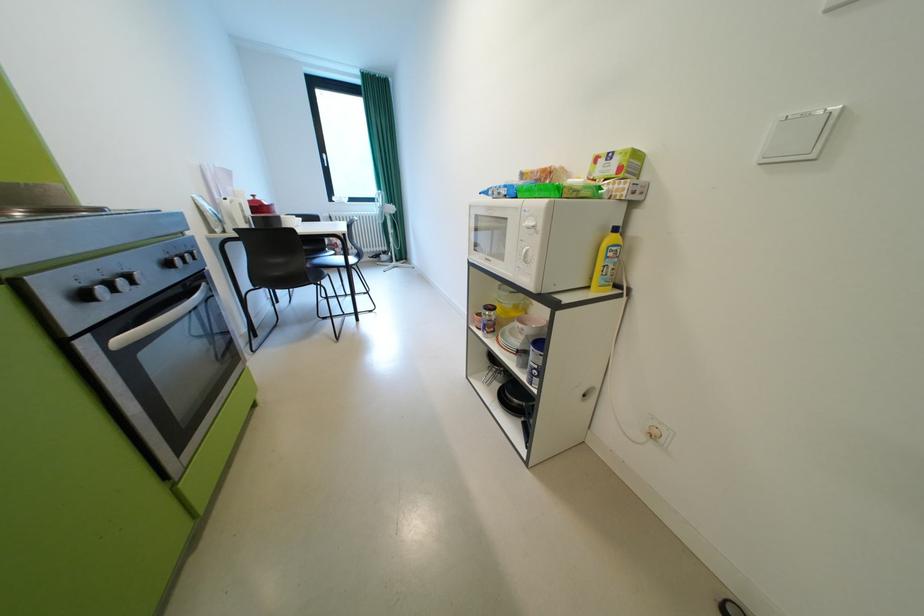
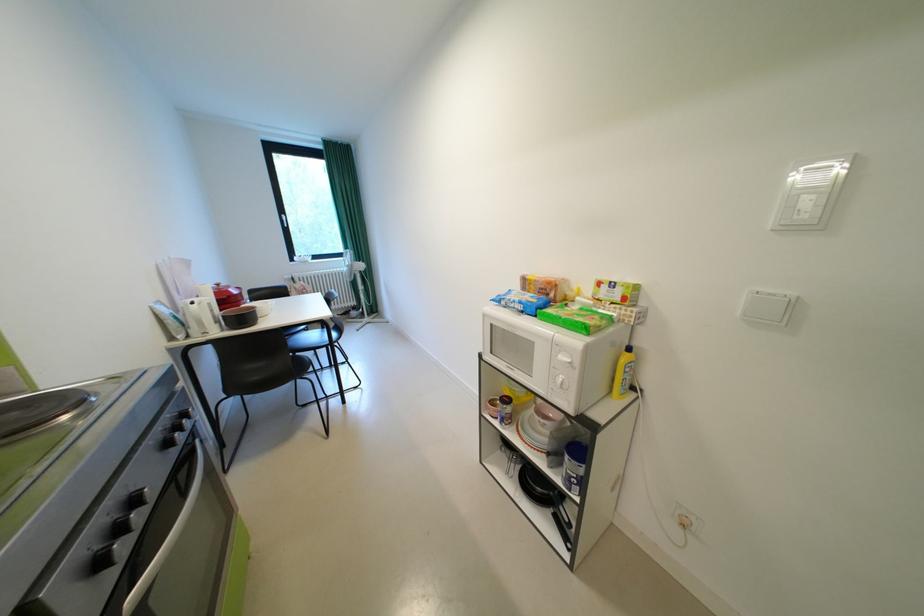
Locate, in the second image, the point that corresponds to point 521,403 in the first image.

(544, 490)